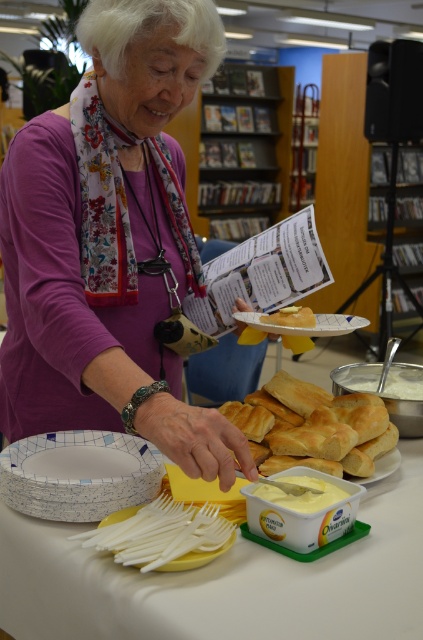
Based on the photo, you are organizing a small event and need to place a decorative item on the table. You have a purple fabric at center and a white paper plate at center. Which item can cover a larger area on the table?

The purple fabric at center has a larger size compared to the white paper plate at center, so it can cover a larger area on the table.

You are organizing a small event and need to place a decorative item on the table. The purple fabric at center and the white paper plate at center are both on the table. Which object is taller and should be placed in a position where height matters?

The purple fabric at center is taller than the white paper plate at center, so it should be placed in a position where height matters.

You are setting up a buffet table for an event and need to place the purple fabric at center and the white creamy spread at center. Given their sizes, which item should you place first to ensure stability?

The purple fabric at center is much taller than the white creamy spread at center, so you should place the purple fabric at center first to provide a stable base for the shorter item.